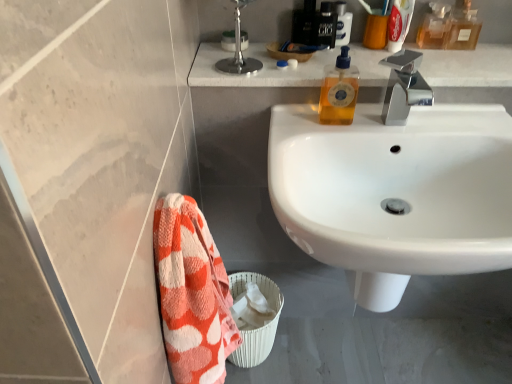
Question: Considering the relative sizes of white glossy sink at center and black plastic soap dispenser at upper right, the third toiletry positioned from the bottom, in the image provided, is white glossy sink at center bigger than black plastic soap dispenser at upper right, the third toiletry positioned from the bottom,?

Choices:
 (A) yes
 (B) no

Answer: (A)

Question: Does white glossy sink at center come in front of black plastic soap dispenser at upper right, which is counted as the 1th toiletry, starting from the back?

Choices:
 (A) yes
 (B) no

Answer: (A)

Question: Does white glossy sink at center have a greater width compared to black plastic soap dispenser at upper right, which is counted as the 1th toiletry, starting from the back?

Choices:
 (A) no
 (B) yes

Answer: (B)

Question: Is white glossy sink at center outside black plastic soap dispenser at upper right, the third toiletry positioned from the bottom?

Choices:
 (A) no
 (B) yes

Answer: (B)

Question: Is black plastic soap dispenser at upper right, arranged as the third toiletry when viewed from the front, at the back of white glossy sink at center?

Choices:
 (A) no
 (B) yes

Answer: (A)

Question: Are white glossy sink at center and black plastic soap dispenser at upper right, arranged as the third toiletry when viewed from the front, making contact?

Choices:
 (A) yes
 (B) no

Answer: (B)

Question: Does polished chrome faucet at upper right come behind translucent amber liquid at upper right, which is counted as the 3th mouthwash, starting from the left?

Choices:
 (A) yes
 (B) no

Answer: (B)

Question: Is polished chrome faucet at upper right looking in the opposite direction of translucent amber liquid at upper right, which is counted as the 3th mouthwash, starting from the left?

Choices:
 (A) no
 (B) yes

Answer: (A)

Question: From the image's perspective, is polished chrome faucet at upper right located above translucent amber liquid at upper right, which is counted as the 3th mouthwash, starting from the left?

Choices:
 (A) no
 (B) yes

Answer: (A)

Question: Is polished chrome faucet at upper right positioned in front of translucent amber liquid at upper right, which is the 2th mouthwash from right to left?

Choices:
 (A) no
 (B) yes

Answer: (B)

Question: Is polished chrome faucet at upper right far away from translucent amber liquid at upper right, which is counted as the 3th mouthwash, starting from the left?

Choices:
 (A) yes
 (B) no

Answer: (B)

Question: From a real-world perspective, does polished chrome faucet at upper right stand above translucent amber liquid at upper right, which is counted as the 3th mouthwash, starting from the left?

Choices:
 (A) yes
 (B) no

Answer: (B)

Question: Is shiny black bottle at upper center, the 2th toiletry in the back-to-front sequence, wider than white plastic toothpaste tube at upper right, the third mouthwash in the right-to-left sequence?

Choices:
 (A) yes
 (B) no

Answer: (A)